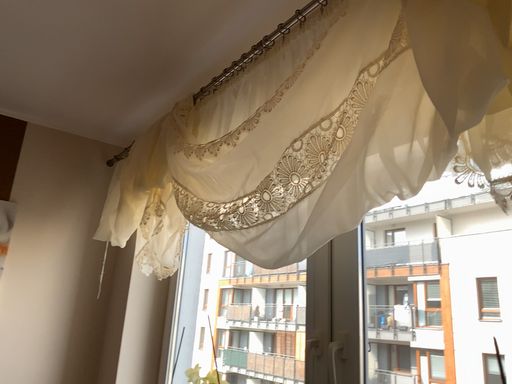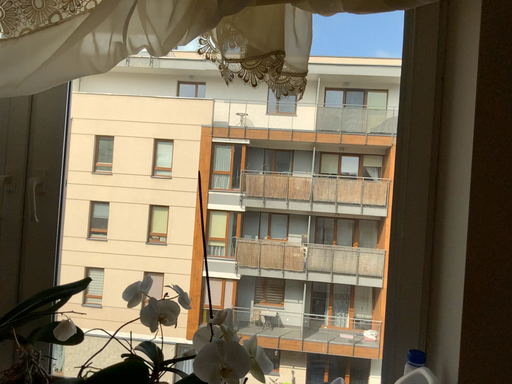
Question: How did the camera likely rotate when shooting the video?

Choices:
 (A) rotated downward
 (B) rotated upward

Answer: (A)